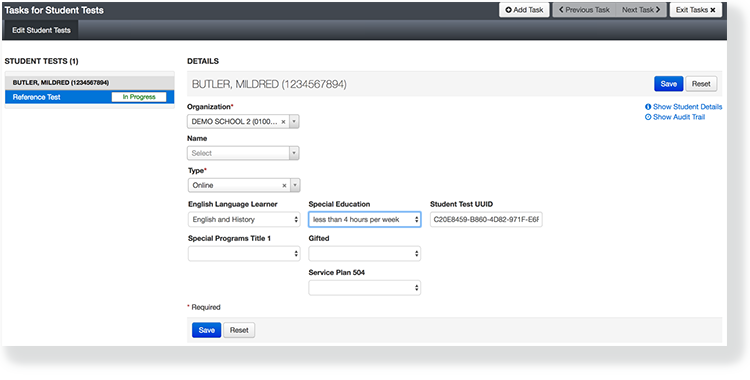
The image size is (750, 380). Identify the location of english entry area. (199, 217).